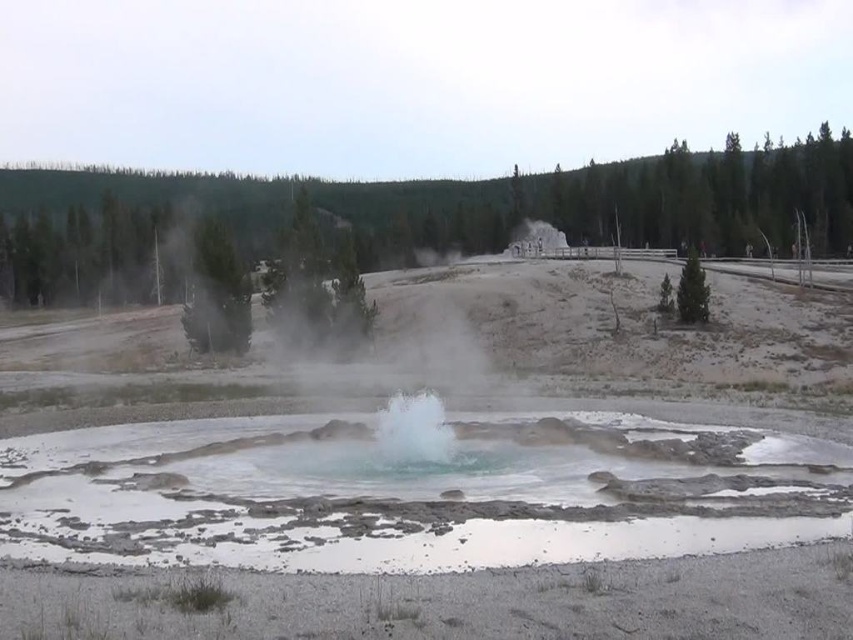
Does translucent blue water at center have a smaller size compared to white frothy steam at center?

Incorrect, translucent blue water at center is not smaller in size than white frothy steam at center.

Does point (337, 483) lie in front of point (438, 445)?

Yes, point (337, 483) is closer to viewer.

Image resolution: width=853 pixels, height=640 pixels. In order to click on translucent blue water at center in this screenshot , I will do `click(415, 492)`.